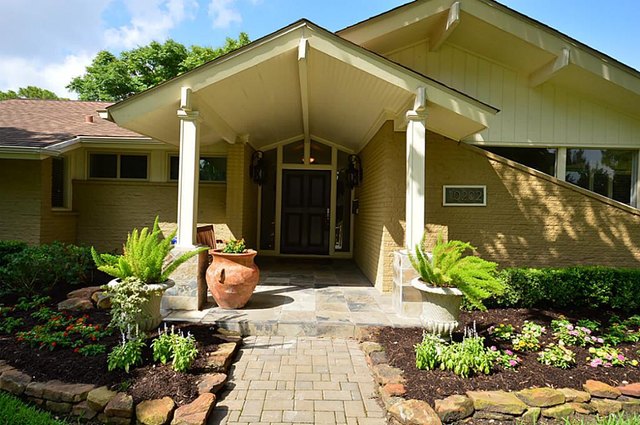
The image size is (640, 425). I want to click on terracotta pot, so click(230, 274).